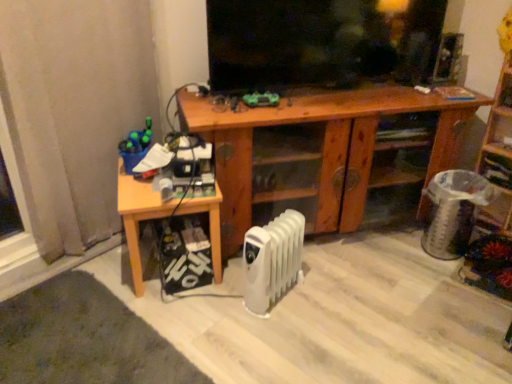
Locate an element on the screen. vacant region to the left of green matte toy at center, placed as the second toy when sorted from left to right is located at coordinates (220, 107).